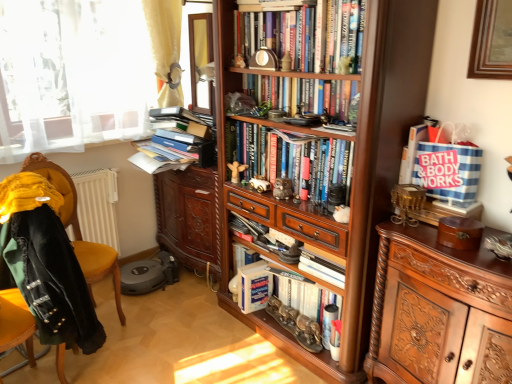
I want to click on vacant space that is to the left of wooden bookcase at center, so click(x=192, y=336).